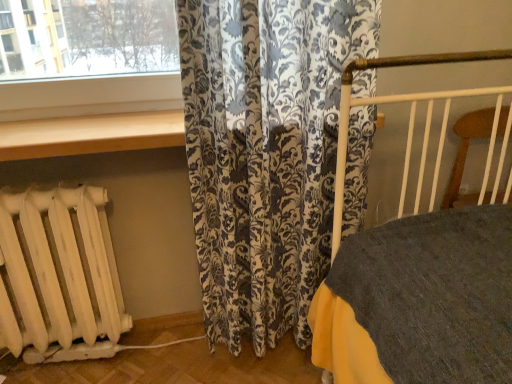
Question: Can you confirm if white matte radiator at lower left is shorter than wooden at upper center?

Choices:
 (A) no
 (B) yes

Answer: (A)

Question: Is white matte radiator at lower left not close to wooden at upper center?

Choices:
 (A) no
 (B) yes

Answer: (A)

Question: Considering the relative sizes of white matte radiator at lower left and wooden at upper center in the image provided, is white matte radiator at lower left smaller than wooden at upper center?

Choices:
 (A) no
 (B) yes

Answer: (A)

Question: From a real-world perspective, is white matte radiator at lower left located higher than wooden at upper center?

Choices:
 (A) yes
 (B) no

Answer: (B)

Question: Can you confirm if white matte radiator at lower left is taller than wooden at upper center?

Choices:
 (A) yes
 (B) no

Answer: (A)

Question: Considering the positions of point (94, 139) and point (47, 329), is point (94, 139) closer or farther from the camera than point (47, 329)?

Choices:
 (A) farther
 (B) closer

Answer: (B)

Question: In the image, is wooden at upper center positioned in front of or behind white matte radiator at lower left?

Choices:
 (A) behind
 (B) front

Answer: (B)

Question: From the image's perspective, relative to white matte radiator at lower left, is wooden at upper center above or below?

Choices:
 (A) above
 (B) below

Answer: (A)

Question: Visually, is wooden at upper center positioned to the left or to the right of white matte radiator at lower left?

Choices:
 (A) left
 (B) right

Answer: (B)

Question: From a real-world perspective, is wooden at upper center physically located above or below floral-patterned fabric at center?

Choices:
 (A) above
 (B) below

Answer: (A)

Question: Is point (181, 114) closer or farther from the camera than point (291, 56)?

Choices:
 (A) closer
 (B) farther

Answer: (B)

Question: From the image's perspective, is wooden at upper center located above or below floral-patterned fabric at center?

Choices:
 (A) below
 (B) above

Answer: (B)

Question: Based on their sizes in the image, would you say wooden at upper center is bigger or smaller than floral-patterned fabric at center?

Choices:
 (A) big
 (B) small

Answer: (B)

Question: Looking at their shapes, would you say floral-patterned fabric at center is wider or thinner than wooden at upper center?

Choices:
 (A) wide
 (B) thin

Answer: (B)

Question: From the image's perspective, is floral-patterned fabric at center above or below wooden at upper center?

Choices:
 (A) above
 (B) below

Answer: (B)